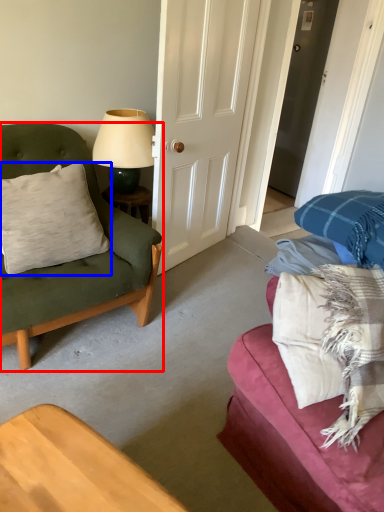
Question: Which point is further to the camera, chair (highlighted by a red box) or pillow (highlighted by a blue box)?

Choices:
 (A) chair
 (B) pillow

Answer: (B)